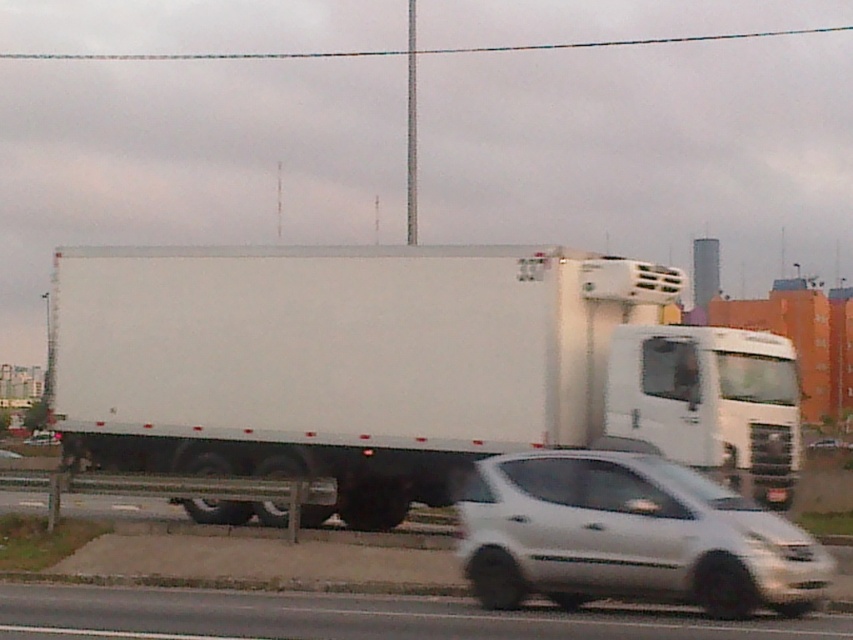
Based on the photo, you are a pedestrian standing on the sidewalk next to the road. You see a white matte car at lower right and a white glossy car at lower center. Which car is closer to you?

The white matte car at lower right is closer to you because it is smaller than the white glossy car at lower center, and smaller objects typically appear closer in such scenes.

You are a driver in a car approaching the white matte truck at center. Based on its position at coordinates point 0.575, 0.472, can you estimate where the truck is located on the road relative to your position?

The white matte truck at center is located at point (402, 368), which means it is positioned in the central part of the road, slightly to the right side. This coordinate places it ahead and to the right of your current position as you approach it.

You are standing at the point labeled as point (x=402, y=368) in the image. What object is located at this point?

The point (x=402, y=368) corresponds to the white matte truck at center.